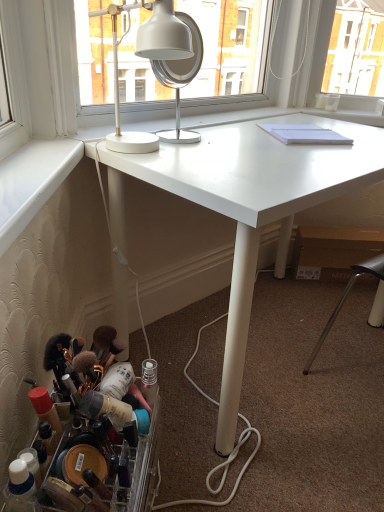
Question: Is white glossy desk lamp at upper center further to the viewer compared to white metallic mirror at upper center?

Choices:
 (A) no
 (B) yes

Answer: (A)

Question: Is white glossy desk lamp at upper center to the left of white metallic mirror at upper center from the viewer's perspective?

Choices:
 (A) yes
 (B) no

Answer: (A)

Question: Is white glossy desk lamp at upper center outside of white metallic mirror at upper center?

Choices:
 (A) no
 (B) yes

Answer: (B)

Question: From the image's perspective, is white glossy desk lamp at upper center above white metallic mirror at upper center?

Choices:
 (A) no
 (B) yes

Answer: (A)

Question: From the image's perspective, would you say white glossy desk lamp at upper center is shown under white metallic mirror at upper center?

Choices:
 (A) no
 (B) yes

Answer: (B)

Question: Is the depth of white glossy desk lamp at upper center less than that of white metallic mirror at upper center?

Choices:
 (A) no
 (B) yes

Answer: (B)

Question: From the image's perspective, is white matte desk at center on white metallic mirror at upper center?

Choices:
 (A) yes
 (B) no

Answer: (B)

Question: Does white matte desk at center have a lesser height compared to white metallic mirror at upper center?

Choices:
 (A) no
 (B) yes

Answer: (A)

Question: Is white matte desk at center wider than white metallic mirror at upper center?

Choices:
 (A) yes
 (B) no

Answer: (A)

Question: From a real-world perspective, is white matte desk at center physically above white metallic mirror at upper center?

Choices:
 (A) no
 (B) yes

Answer: (A)

Question: Is white matte desk at center smaller than white metallic mirror at upper center?

Choices:
 (A) yes
 (B) no

Answer: (B)

Question: Is the depth of white matte desk at center greater than that of white metallic mirror at upper center?

Choices:
 (A) no
 (B) yes

Answer: (A)

Question: Considering the relative sizes of translucent plastic container at lower left and white metallic mirror at upper center in the image provided, is translucent plastic container at lower left smaller than white metallic mirror at upper center?

Choices:
 (A) yes
 (B) no

Answer: (B)